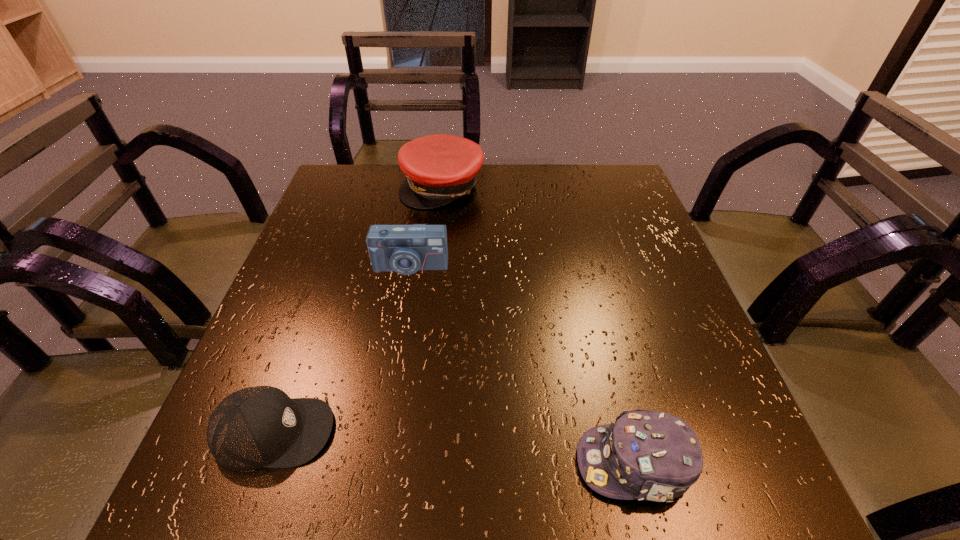
Find the location of a particular element. The image size is (960, 540). free space in the image that satisfies the following two spatial constraints: 1. on the lens of the camera; 2. on the front-facing side of the leftmost headwear is located at coordinates (381, 433).